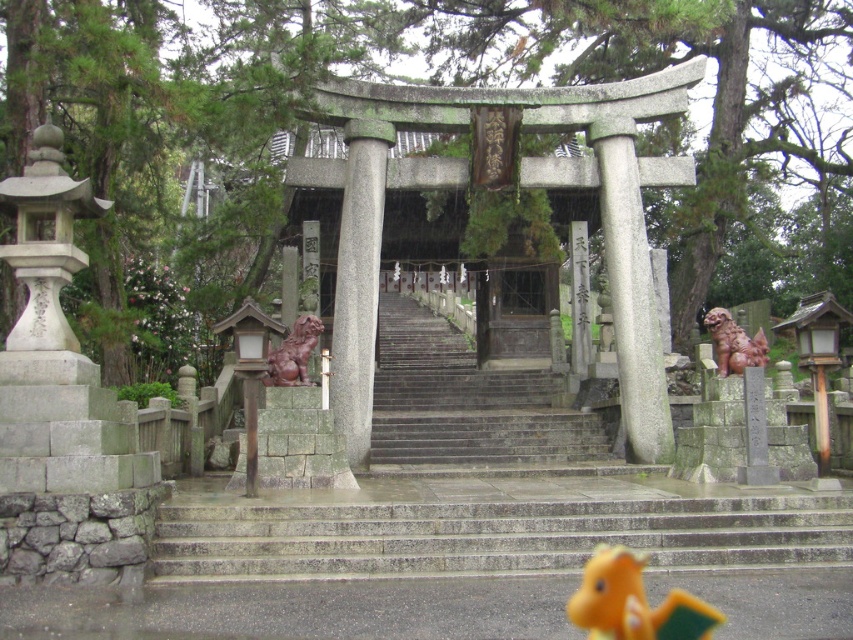
Question: Among these objects, which one is nearest to the camera?

Choices:
 (A) brown glossy statue at right
 (B) orange plush toy at lower center
 (C) brown polished stone lion at center
 (D) gray polished stone column at center

Answer: (B)

Question: Can you confirm if gray concrete stairs at center is thinner than brown polished stone lion at center?

Choices:
 (A) yes
 (B) no

Answer: (B)

Question: Does gray concrete stairs at center appear on the right side of brown glossy statue at right?

Choices:
 (A) no
 (B) yes

Answer: (A)

Question: Which point is farther to the camera?

Choices:
 (A) (677, 593)
 (B) (759, 340)
 (C) (276, 364)

Answer: (B)

Question: Considering the relative positions of gray polished stone column at center and orange plush toy at lower center in the image provided, where is gray polished stone column at center located with respect to orange plush toy at lower center?

Choices:
 (A) above
 (B) below

Answer: (A)

Question: Which point is closer to the camera?

Choices:
 (A) (631, 573)
 (B) (740, 340)
 (C) (271, 376)

Answer: (A)